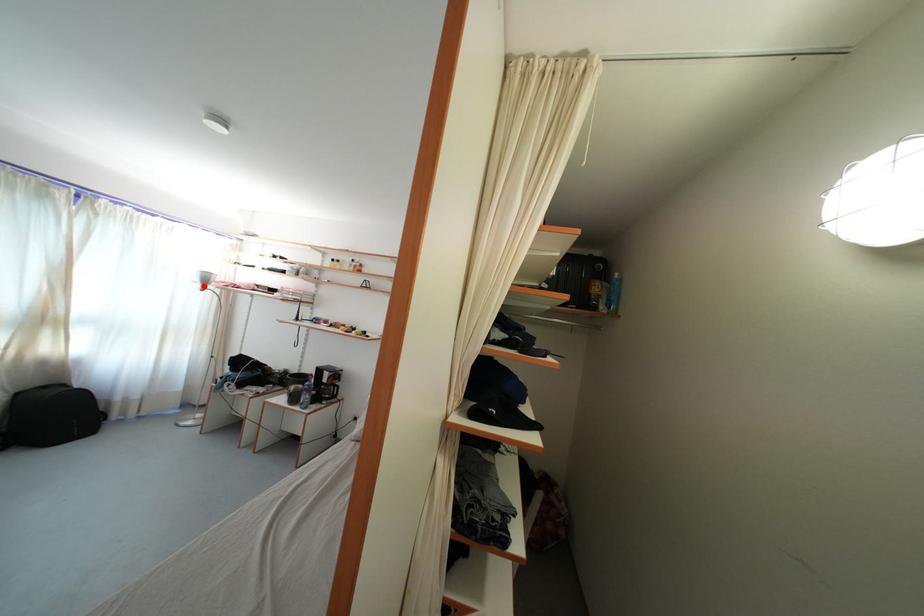
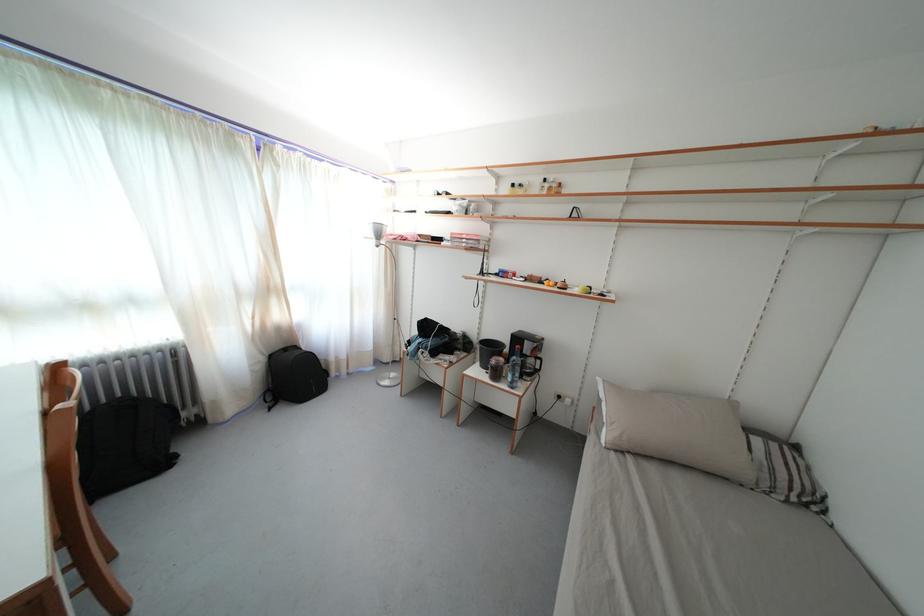
Question: I am providing you with two images of the same scene from different viewpoints. A red point is marked on the first image. Is the red point's position out of view in image 2?

Choices:
 (A) Yes
 (B) No

Answer: (B)